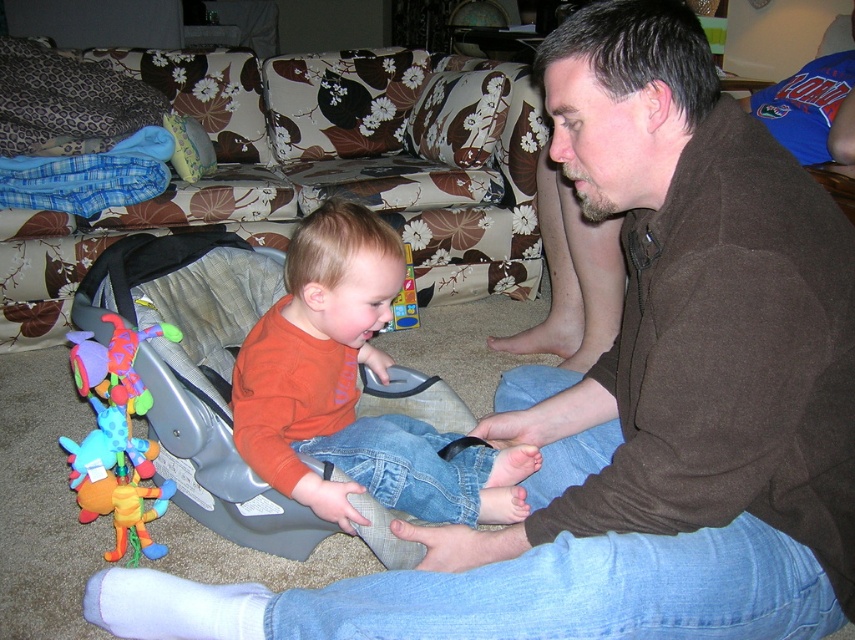
You are a parent trying to decide whether to place a new toy in the space between the orange soft shirt at center and the plush multicolored baby rattle at left. The new toy is 15 cm wide. Can the space accommodate it?

The orange soft shirt at center is wider than the plush multicolored baby rattle at left. However, the exact width difference isn not provided, so it is uncertain if the space between them can fit a 15 cm wide toy. Consider measuring the gap first.

You are standing in the living room and want to place a small plant pot at the point marked as point [488,476]. If the plant pot requires 3 feet of space from the camera to avoid blocking the view, will placing it there be suitable?

The distance of point [488,476] from the camera is 4.38 feet, which is more than the required 3 feet. Therefore, placing the plant pot there will be suitable as it won

You are a parent trying to clean up the living room. You need to put away the orange soft shirt at center and the plush multicolored baby rattle at left. Which item should you put away first if you want to start with the one that is closer to you?

The orange soft shirt at center is in front of the plush multicolored baby rattle at left, so you should put away the orange soft shirt at center first since it is closer to you.